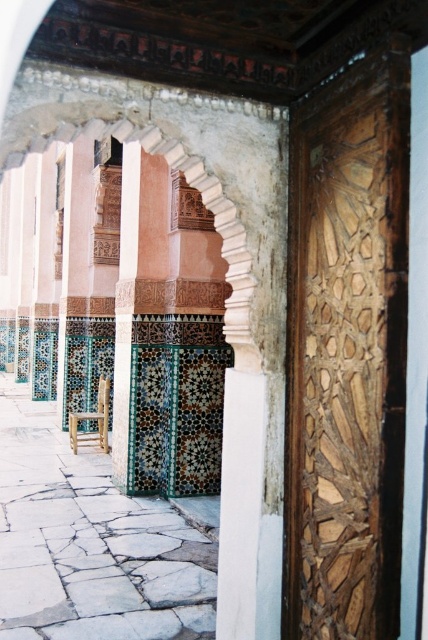
Does point (130, 195) lie behind point (101, 420)?

No, it is not.

Does green mosaic tile at center have a greater height compared to wooden chair at center?

Yes, green mosaic tile at center is taller than wooden chair at center.

Who is more forward, (125, 166) or (71, 438)?

Point (125, 166) is in front.

This screenshot has height=640, width=428. What are the coordinates of `green mosaic tile at center` in the screenshot? It's located at (125, 308).